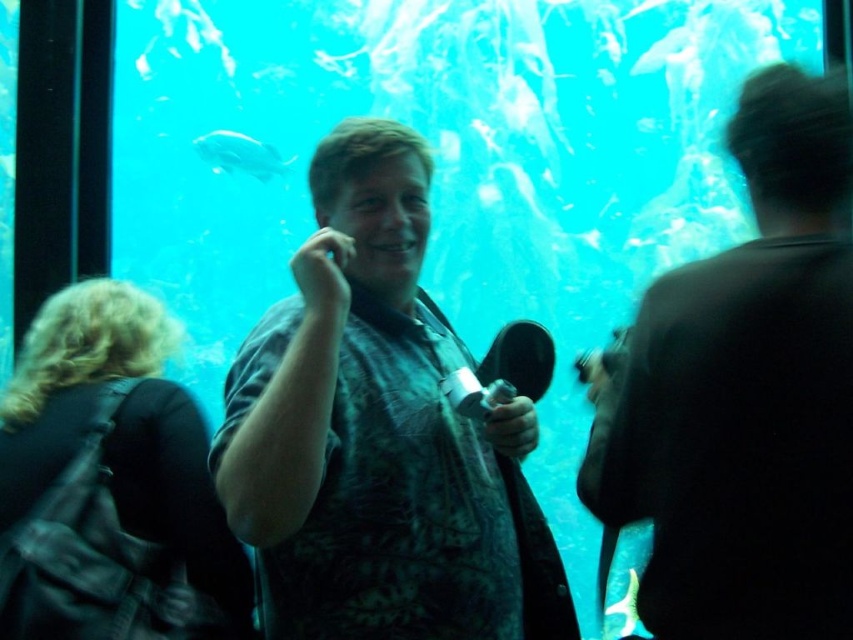
Question: Which point is farther to the camera?

Choices:
 (A) (631, 570)
 (B) (160, 632)

Answer: (A)

Question: Does textured gray shirt at center have a smaller size compared to dark hair at left?

Choices:
 (A) yes
 (B) no

Answer: (B)

Question: Is textured gray shirt at center above black matte shirt at upper right?

Choices:
 (A) no
 (B) yes

Answer: (A)

Question: Which object is closer to the camera taking this photo?

Choices:
 (A) black matte shirt at upper right
 (B) dark hair at left

Answer: (A)

Question: Can you confirm if black matte shirt at upper right is positioned above translucent blue fish at upper center?

Choices:
 (A) yes
 (B) no

Answer: (B)

Question: Which of these objects is positioned farthest from the textured gray shirt at center?

Choices:
 (A) satin silver fish at upper left
 (B) green matte fish at center

Answer: (A)